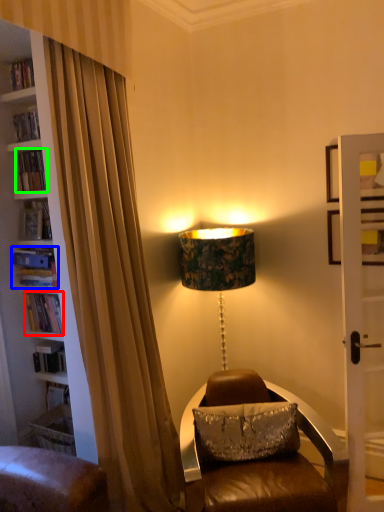
Question: Which object is the farthest from book (highlighted by a red box)? Choose among these: book (highlighted by a blue box) or book (highlighted by a green box).

Choices:
 (A) book
 (B) book

Answer: (B)